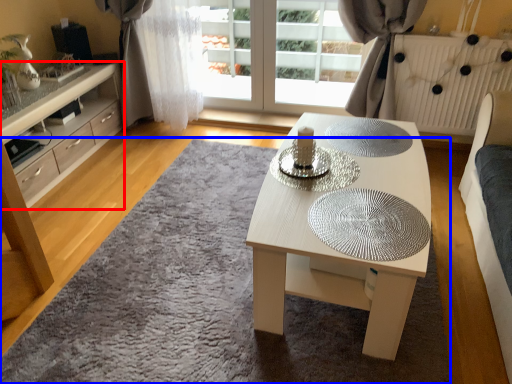
Question: Which object is further to the camera taking this photo, cabinetry (highlighted by a red box) or mat (highlighted by a blue box)?

Choices:
 (A) cabinetry
 (B) mat

Answer: (A)